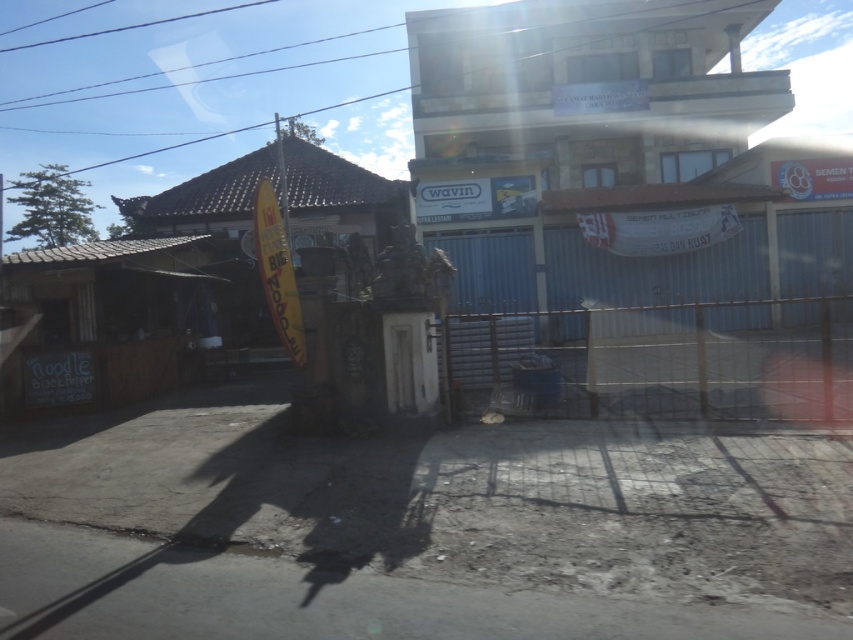
Does dirt track at lower center appear over metallic gate at center?

Incorrect, dirt track at lower center is not positioned above metallic gate at center.

Who is positioned more to the right, dirt track at lower center or metallic gate at center?

Positioned to the right is metallic gate at center.

At what (x,y) coordinates should I click in order to perform the action: click on dirt track at lower center. Please return your answer as a coordinate pair (x, y). This screenshot has height=640, width=853. Looking at the image, I should click on 421,528.

Find the location of a particular element. The height and width of the screenshot is (640, 853). dirt track at lower center is located at coordinates (421, 528).